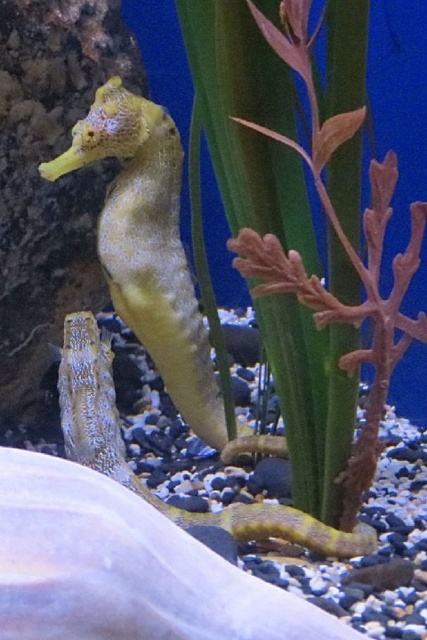
Between yellow matte seahorse at center and shiny blue seahorse at center, which one has less height?

Standing shorter between the two is shiny blue seahorse at center.

Between yellow matte seahorse at center and shiny blue seahorse at center, which one appears on the right side from the viewer's perspective?

From the viewer's perspective, shiny blue seahorse at center appears more on the right side.

The height and width of the screenshot is (640, 427). Find the location of `yellow matte seahorse at center`. yellow matte seahorse at center is located at coordinates (154, 256).

Between point (310, 438) and point (116, 468), which one is positioned behind?

Point (310, 438)

Based on the photo, is green matte plant at center below shiny blue seahorse at center?

Incorrect, green matte plant at center is not positioned below shiny blue seahorse at center.

What do you see at coordinates (303, 221) in the screenshot?
I see `green matte plant at center` at bounding box center [303, 221].

Find the location of a particular element. green matte plant at center is located at coordinates (303, 221).

Image resolution: width=427 pixels, height=640 pixels. What do you see at coordinates (303, 221) in the screenshot? I see `green matte plant at center` at bounding box center [303, 221].

Is green matte plant at center taller than yellow matte seahorse at center?

Indeed, green matte plant at center has a greater height compared to yellow matte seahorse at center.

This screenshot has height=640, width=427. In order to click on green matte plant at center in this screenshot , I will do `click(303, 221)`.